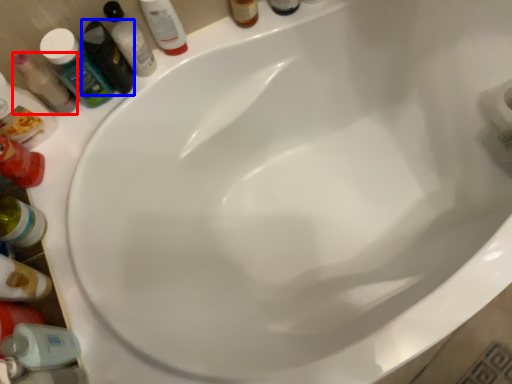
Question: Which object is closer to the camera taking this photo, mouthwash (highlighted by a red box) or toiletry (highlighted by a blue box)?

Choices:
 (A) mouthwash
 (B) toiletry

Answer: (A)